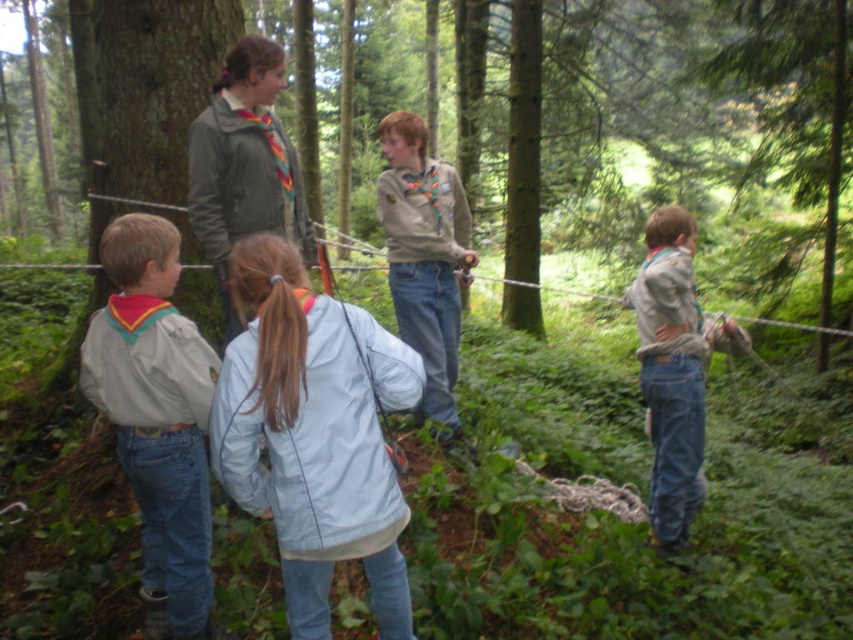
Is point (231, 435) positioned in front of point (128, 323)?

Yes, it is in front of point (128, 323).

Does light blue fabric jacket at center have a lesser height compared to light gray fleece jacket at left?

Correct, light blue fabric jacket at center is not as tall as light gray fleece jacket at left.

Between point (335, 321) and point (146, 372), which one is positioned in front?

Point (335, 321)

I want to click on light blue fabric jacket at center, so click(314, 435).

Which is in front, point (183, 88) or point (440, 232)?

Point (440, 232) is in front.

In the scene shown: Is smooth bark tree at left positioned at the back of light brown uniform at center?

Yes, it is behind light brown uniform at center.

The image size is (853, 640). I want to click on smooth bark tree at left, so click(144, 86).

At what (x,y) coordinates should I click in order to perform the action: click on smooth bark tree at left. Please return your answer as a coordinate pair (x, y). The width and height of the screenshot is (853, 640). Looking at the image, I should click on (144, 86).

Between light blue fabric jacket at center and smooth bark tree at left, which one is positioned lower?

Positioned lower is light blue fabric jacket at center.

Identify the location of light blue fabric jacket at center. (314, 435).